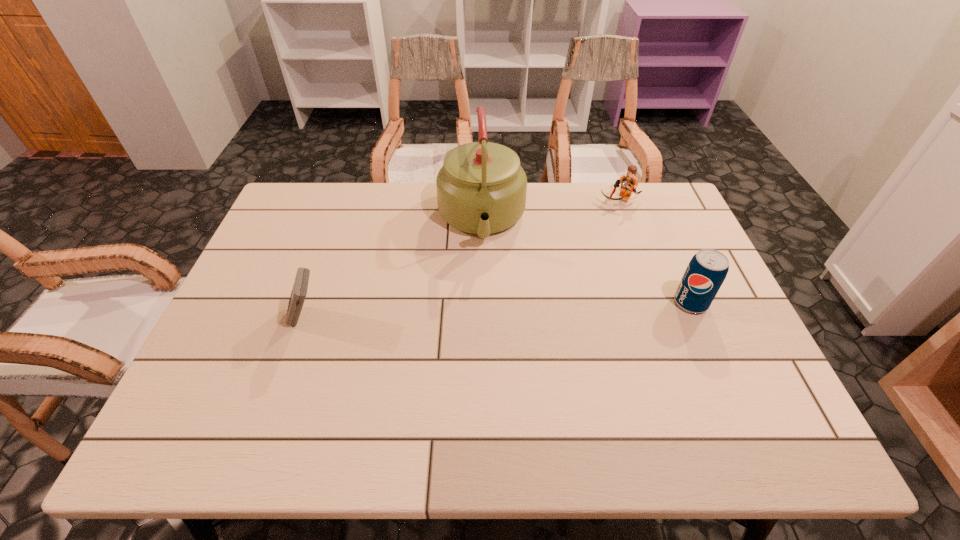
This screenshot has width=960, height=540. What are the coordinates of `vacant space located at the spout of the second object from left to right` in the screenshot? It's located at (488, 326).

Find the location of `vacant space located 0.080m at the spout of the second object from left to right`. vacant space located 0.080m at the spout of the second object from left to right is located at coordinates (485, 280).

You are a GUI agent. You are given a task and a screenshot of the screen. Output one action in this format:
    pyautogui.click(x=<x>, y=<y>)
    Task: Click on the free space located 0.370m holding a crossbow in the hands of the Lego
    The width and height of the screenshot is (960, 540).
    Given the screenshot: What is the action you would take?
    pyautogui.click(x=558, y=275)

In order to click on free location located holding a crossbow in the hands of the Lego in this screenshot , I will do `click(560, 273)`.

The height and width of the screenshot is (540, 960). Find the location of `vacant space located 0.220m holding a crossbow in the hands of the Lego`. vacant space located 0.220m holding a crossbow in the hands of the Lego is located at coordinates [581, 245].

This screenshot has height=540, width=960. I want to click on kettle that is at the far edge, so click(481, 188).

In order to click on Lego that is positioned at the far edge in this screenshot , I will do `click(629, 182)`.

Identify the location of object at the left edge. This screenshot has width=960, height=540. (299, 291).

What are the coordinates of `pop situated at the right edge` in the screenshot? It's located at (707, 270).

Locate an element on the screen. This screenshot has height=540, width=960. Lego located in the right edge section of the desktop is located at coordinates (629, 182).